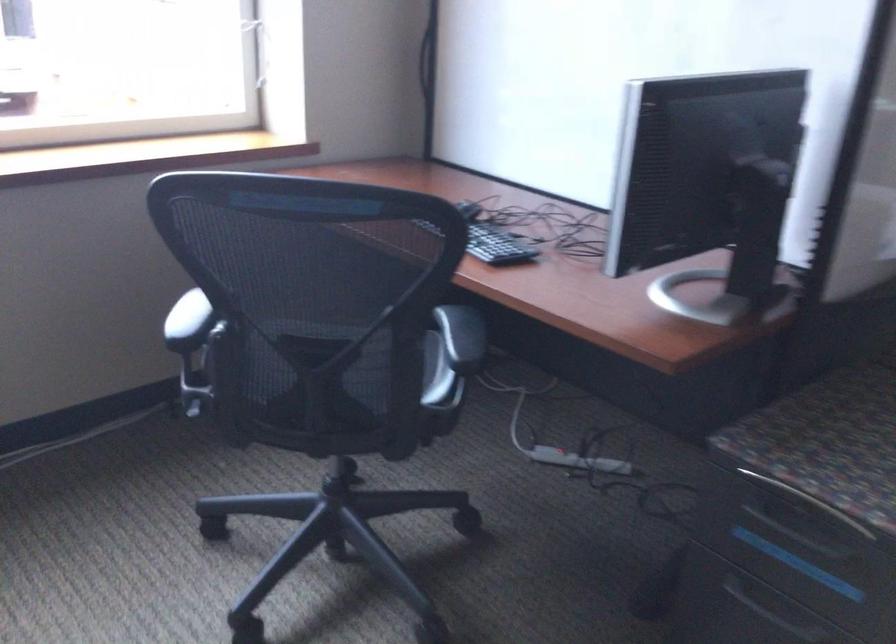
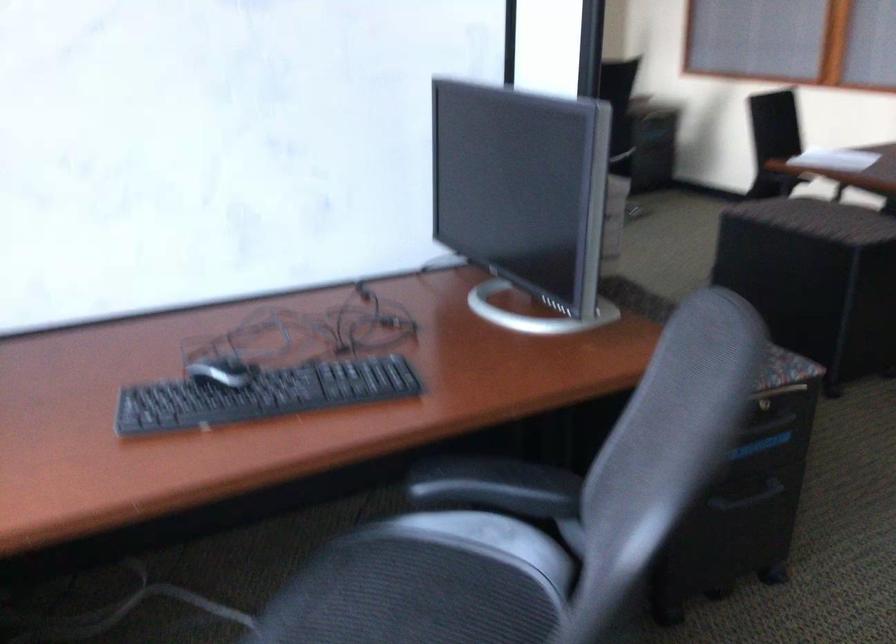
The point at (453,327) is marked in the first image. Where is the corresponding point in the second image?

(495, 486)